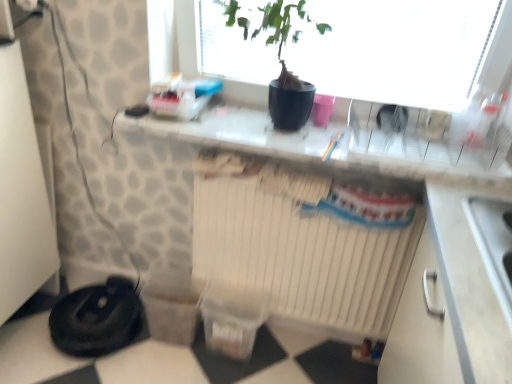
Question: From the image's perspective, is white glossy countertop at center above or below black matte pot at upper center?

Choices:
 (A) below
 (B) above

Answer: (A)

Question: In terms of height, does white glossy countertop at center look taller or shorter compared to black matte pot at upper center?

Choices:
 (A) short
 (B) tall

Answer: (A)

Question: Which is nearer to the black matte pot at upper center?

Choices:
 (A) white matte radiator at center
 (B) white glossy countertop at center
 (C) black rubber vacuum cleaner at lower left

Answer: (B)

Question: Which object is the closest to the black rubber vacuum cleaner at lower left?

Choices:
 (A) white glossy countertop at center
 (B) black matte pot at upper center
 (C) white matte radiator at center

Answer: (C)